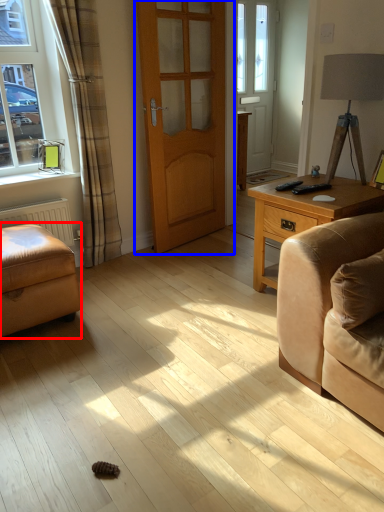
Question: Among these objects, which one is nearest to the camera, armchair (highlighted by a red box) or door (highlighted by a blue box)?

Choices:
 (A) armchair
 (B) door

Answer: (A)